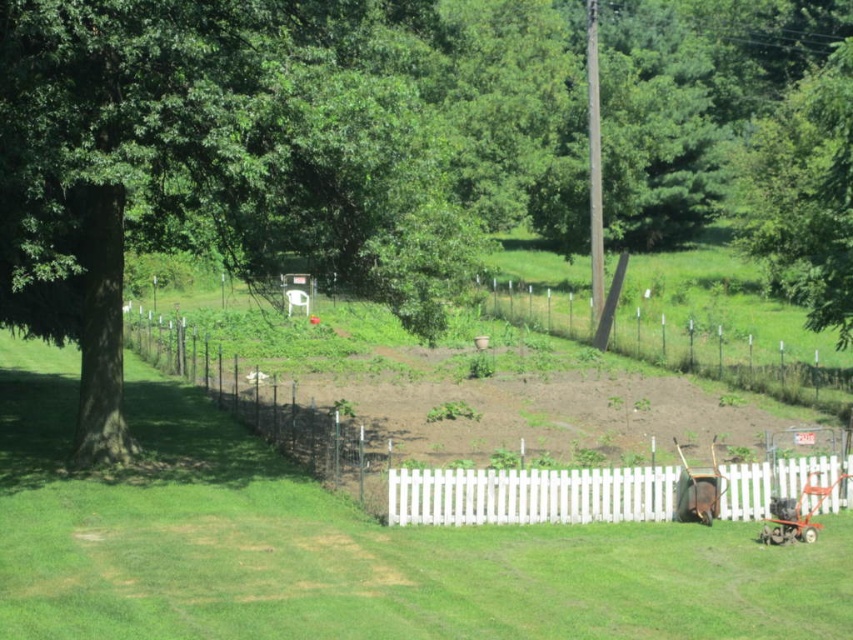
Question: Does white picket fence at lower right have a lesser width compared to rusty metal wheelbarrow at lower right?

Choices:
 (A) yes
 (B) no

Answer: (B)

Question: Which point is farther to the camera?

Choices:
 (A) (778, 486)
 (B) (686, 472)
 (C) (334, 480)

Answer: (C)

Question: Which point is farther to the camera?

Choices:
 (A) metallic red baby carriage at lower right
 (B) green leafy tree at upper left
 (C) rusty metal wheelbarrow at lower right

Answer: (C)

Question: Is green leafy tree at upper left in front of rusty metal wheelbarrow at lower right?

Choices:
 (A) no
 (B) yes

Answer: (B)

Question: Considering the real-world distances, which object is farthest from the rusty metal wheelbarrow at lower right?

Choices:
 (A) green leafy tree at upper left
 (B) white picket fence at center
 (C) metallic red baby carriage at lower right
 (D) white picket fence at lower right

Answer: (A)

Question: Is white picket fence at lower right bigger than metallic red baby carriage at lower right?

Choices:
 (A) yes
 (B) no

Answer: (A)